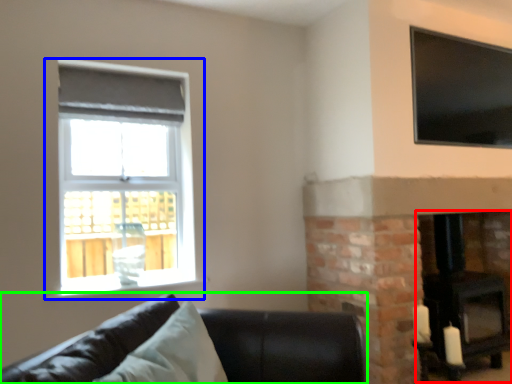
Question: Estimate the real-world distances between objects in this image. Which object is closer to fireplace (highlighted by a red box), window (highlighted by a blue box) or studio couch (highlighted by a green box)?

Choices:
 (A) window
 (B) studio couch

Answer: (B)